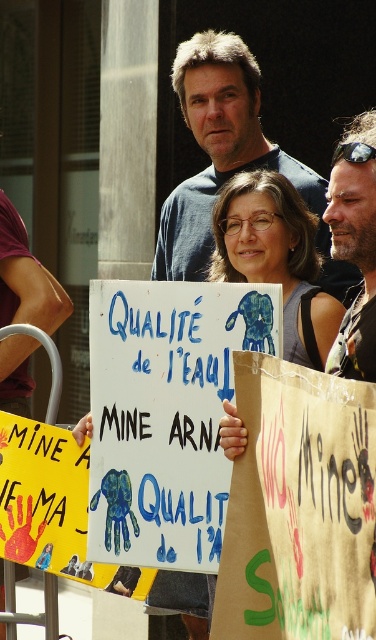
Question: Which object appears closest to the camera in this image?

Choices:
 (A) white paper sign at center
 (B) blue cotton shirt at center
 (C) matte blue sign at center
 (D) bearded man at center

Answer: (D)

Question: Does blue cotton shirt at center appear on the right side of white paper sign at center?

Choices:
 (A) no
 (B) yes

Answer: (A)

Question: Can you confirm if white paper sign at center is wider than matte blue sign at center?

Choices:
 (A) no
 (B) yes

Answer: (B)

Question: Which of the following is the closest to the observer?

Choices:
 (A) (301, 358)
 (B) (339, 337)
 (C) (221, 244)

Answer: (B)

Question: Can you confirm if white paper sign at center is bigger than matte blue sign at center?

Choices:
 (A) yes
 (B) no

Answer: (A)

Question: Which point is closer to the camera?

Choices:
 (A) matte blue sign at center
 (B) bearded man at center
 (C) white paper sign at center
 (D) blue cotton shirt at center

Answer: (B)